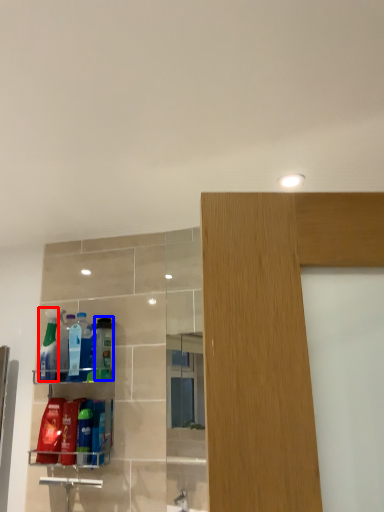
Question: Among these objects, which one is farthest to the camera, cleaning product (highlighted by a red box) or cleaning product (highlighted by a blue box)?

Choices:
 (A) cleaning product
 (B) cleaning product

Answer: (A)